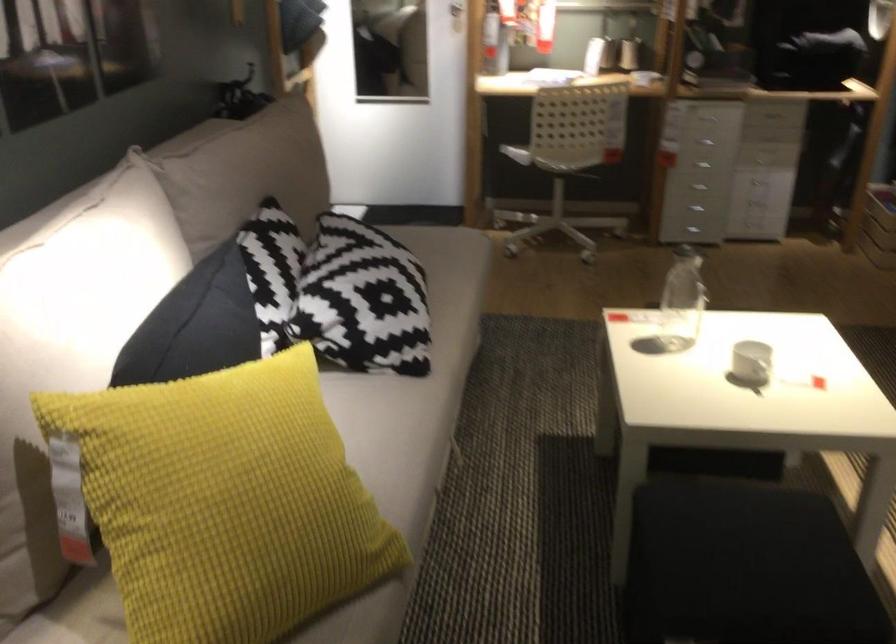
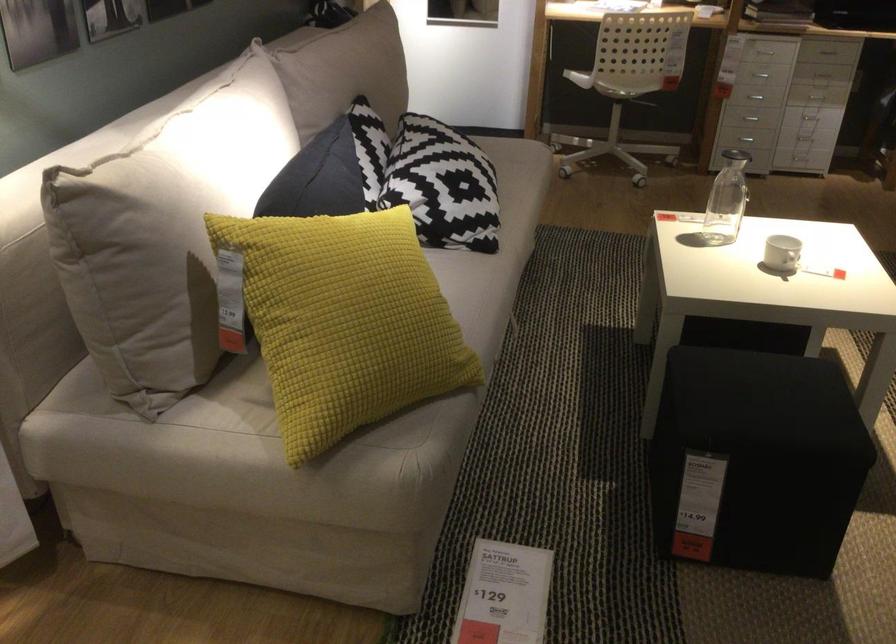
The point at (x=764, y=191) is marked in the first image. Where is the corresponding point in the second image?

(810, 118)